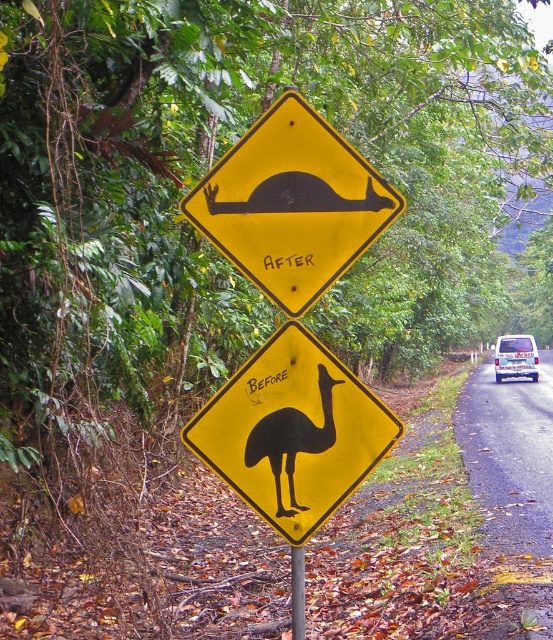
Identify the location of black rubber kangaroo at center. (295, 196).

Who is higher up, black rubber kangaroo at center or white plastic van at right?

black rubber kangaroo at center

Is point (263, 196) positioned before point (502, 337)?

Yes, it is in front of point (502, 337).

I want to click on black rubber kangaroo at center, so click(295, 196).

Who is positioned more to the left, yellow matte/black textured bird at center or metallic gray pole at center?

yellow matte/black textured bird at center is more to the left.

Does yellow matte/black textured bird at center lie behind metallic gray pole at center?

No, yellow matte/black textured bird at center is closer to the viewer.

This screenshot has height=640, width=553. What do you see at coordinates (293, 433) in the screenshot? I see `yellow matte/black textured bird at center` at bounding box center [293, 433].

The height and width of the screenshot is (640, 553). In order to click on yellow matte/black textured bird at center in this screenshot , I will do `click(293, 433)`.

Does yellow matte/black silhouette at center have a greater height compared to white plastic van at right?

No.

Consider the image. Between yellow matte/black silhouette at center and white plastic van at right, which one appears on the left side from the viewer's perspective?

yellow matte/black silhouette at center is more to the left.

Find the location of a particular element. This screenshot has height=640, width=553. yellow matte/black silhouette at center is located at coordinates (291, 204).